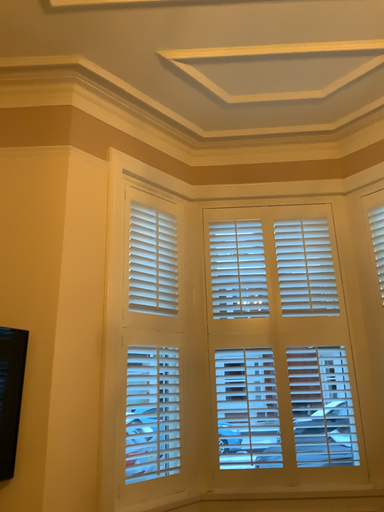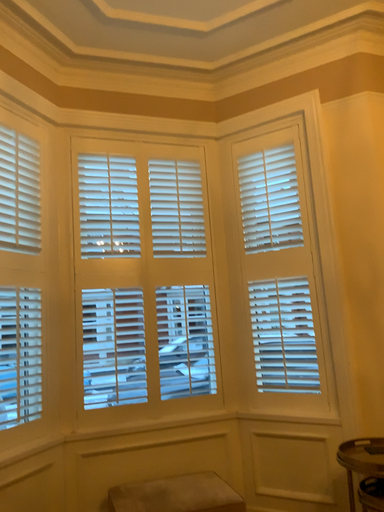
Question: How did the camera likely rotate when shooting the video?

Choices:
 (A) rotated upward
 (B) rotated downward

Answer: (B)